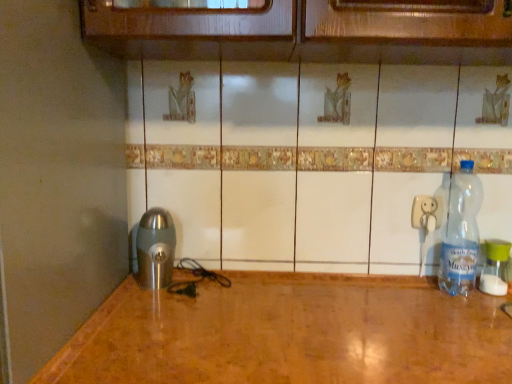
Question: Does point (492, 284) appear closer or farther from the camera than point (416, 213)?

Choices:
 (A) farther
 (B) closer

Answer: (B)

Question: From a real-world perspective, is clear plastic bottle at right, which is the 2th bottle from left to right, above or below white plastic electric outlet at right?

Choices:
 (A) below
 (B) above

Answer: (A)

Question: Which is nearer to the transparent plastic bottle at right, the 1th bottle when ordered from left to right?

Choices:
 (A) brushed metal coffee grinder at lower left
 (B) clear plastic bottle at right, which is the 2th bottle from left to right
 (C) white plastic electric outlet at right

Answer: (C)

Question: Which of these objects is positioned farthest from the clear plastic bottle at right, the first bottle positioned from the right?

Choices:
 (A) white plastic electric outlet at right
 (B) brushed metal coffee grinder at lower left
 (C) transparent plastic bottle at right, the second bottle from the right

Answer: (B)